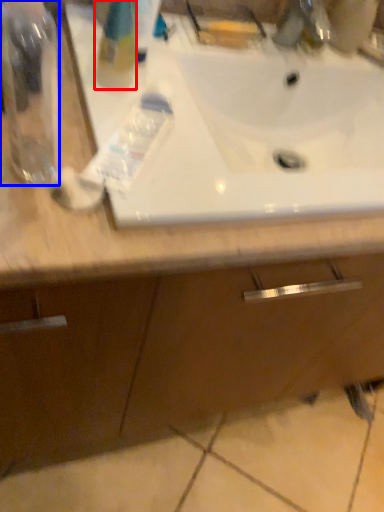
Question: Which object is closer to the camera taking this photo, cleaning product (highlighted by a red box) or bottle (highlighted by a blue box)?

Choices:
 (A) cleaning product
 (B) bottle

Answer: (B)